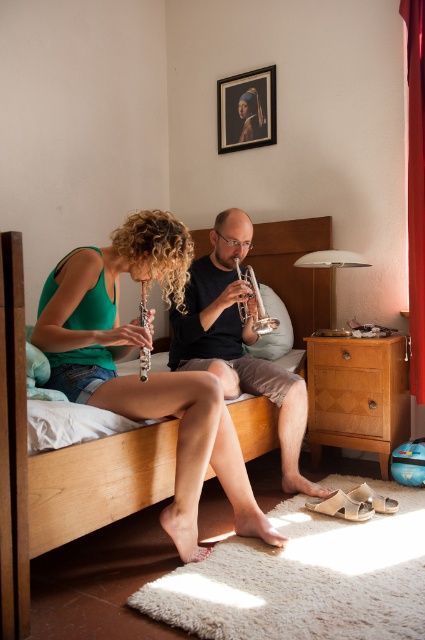
Between point (223, 344) and point (320, 384), which one is positioned in front?

Point (223, 344) is more forward.

Does matte black trumpet at center appear under wooden drawer at center right?

No, matte black trumpet at center is not below wooden drawer at center right.

Which is behind, point (231, 364) or point (309, 419)?

Point (309, 419)

The height and width of the screenshot is (640, 425). Find the location of `matte black trumpet at center`. matte black trumpet at center is located at coordinates (237, 340).

Who is positioned more to the right, light brown wood at right or silver metallic trumpet at center?

light brown wood at right

Between point (328, 429) and point (252, 291), which one is positioned behind?

The point (328, 429) is more distant.

Locate an element on the screen. light brown wood at right is located at coordinates (357, 394).

The image size is (425, 640). In order to click on wooden bed at center in this screenshot , I will do tap(59, 467).

Does wooden bed at center appear on the right side of matte black trumpet at center?

No, wooden bed at center is not to the right of matte black trumpet at center.

Between point (11, 634) and point (283, 442), which one is positioned behind?

The point (283, 442) is more distant.

The image size is (425, 640). Identify the location of wooden bed at center. (59, 467).